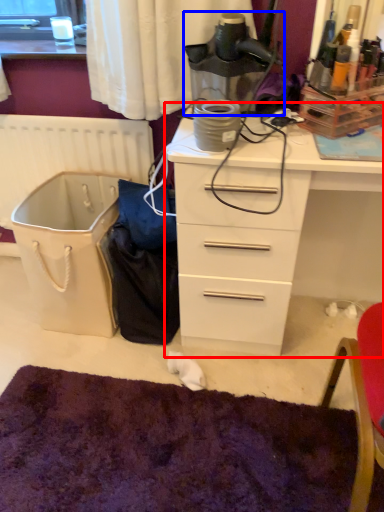
Question: Which object is further to the camera taking this photo, chest of drawers (highlighted by a red box) or appliance (highlighted by a blue box)?

Choices:
 (A) chest of drawers
 (B) appliance

Answer: (B)